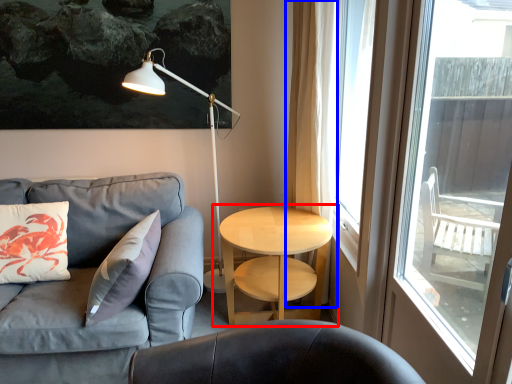
Question: Which object appears closest to the camera in this image, table (highlighted by a red box) or curtain (highlighted by a blue box)?

Choices:
 (A) table
 (B) curtain

Answer: (A)